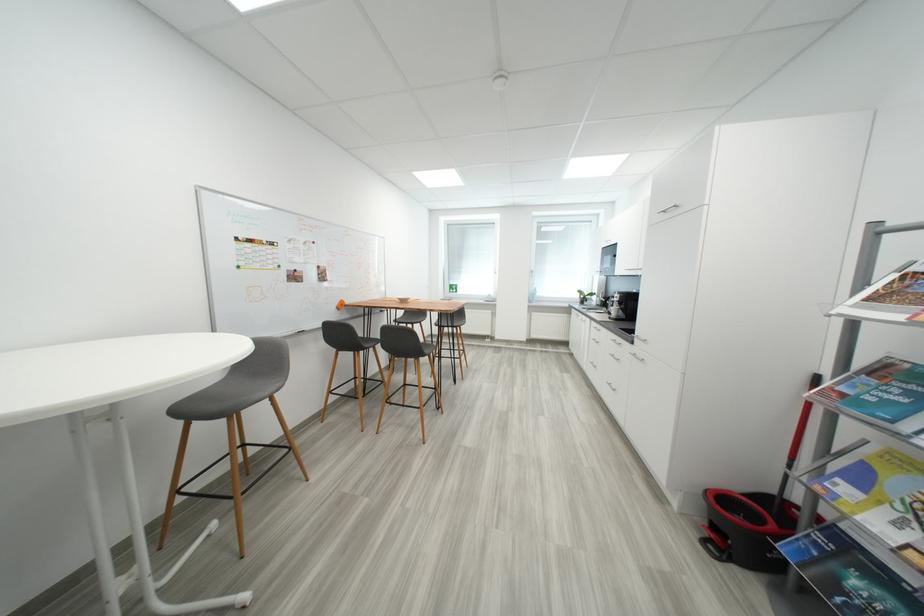
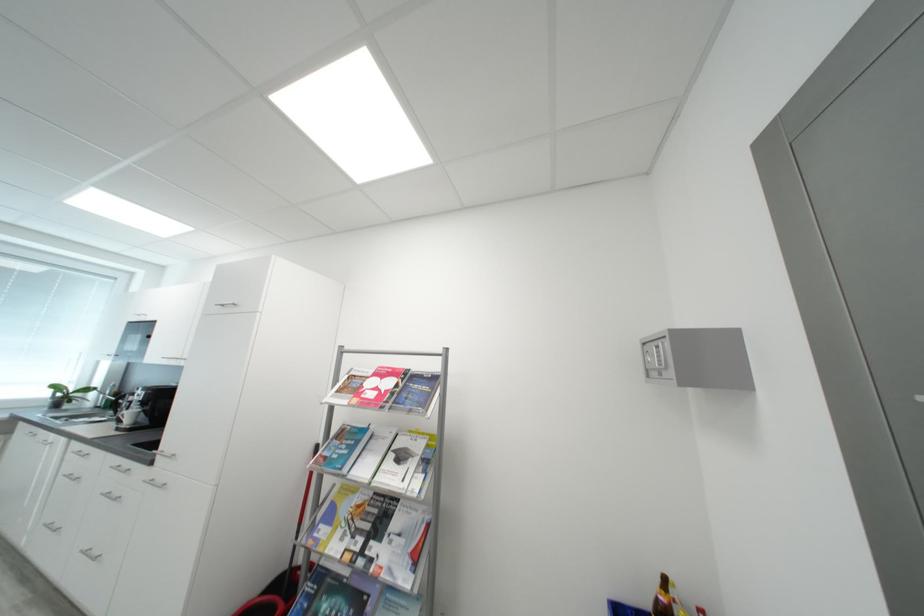
In the second image, find the point that corresponds to (x=671, y=213) in the first image.

(228, 307)